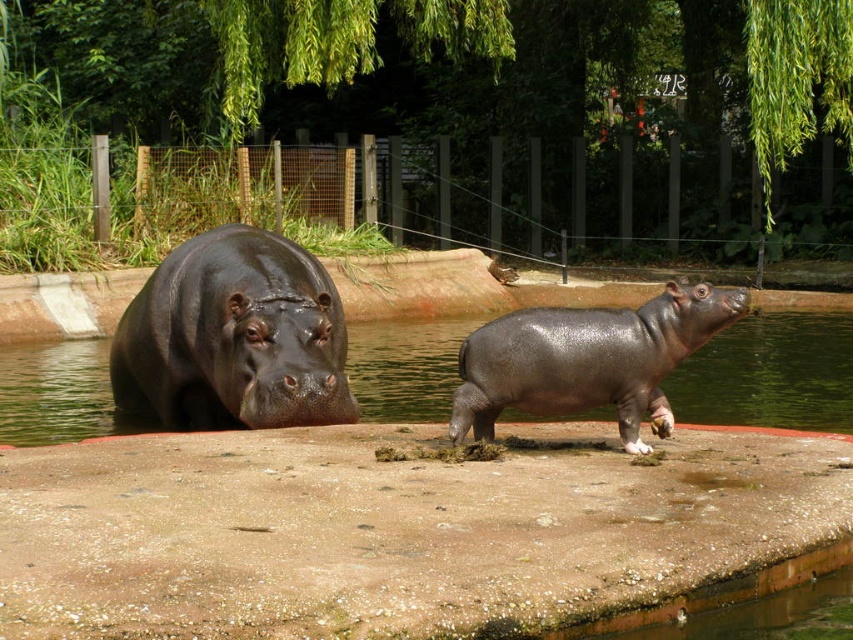
Is shiny dark brown hippo at left below glossy water at hippo right?

Incorrect, shiny dark brown hippo at left is not positioned below glossy water at hippo right.

Can you confirm if shiny dark brown hippo at left is bigger than glossy water at hippo right?

No, shiny dark brown hippo at left is not bigger than glossy water at hippo right.

Is point (155, 275) positioned after point (32, 346)?

No, it is in front of (32, 346).

Identify the location of shiny dark brown hippo at left. This screenshot has height=640, width=853. (231, 339).

Who is shorter, shiny dark brown hippo at left or shiny dark gray hippo at center?

shiny dark gray hippo at center

Describe the element at coordinates (231, 339) in the screenshot. I see `shiny dark brown hippo at left` at that location.

Identify the location of shiny dark brown hippo at left. Image resolution: width=853 pixels, height=640 pixels. (231, 339).

Does glossy water at hippo right have a lesser width compared to shiny dark gray hippo at center?

No, glossy water at hippo right is not thinner than shiny dark gray hippo at center.

Which is in front, point (80, 365) or point (631, 444)?

Point (631, 444) is in front.

Image resolution: width=853 pixels, height=640 pixels. Identify the location of glossy water at hippo right. (770, 372).